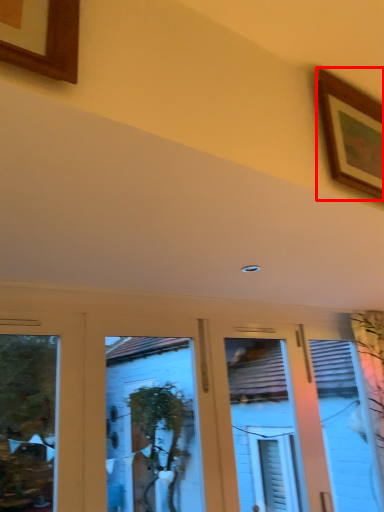
Question: In this image, where is picture frame (annotated by the red box) located relative to hotel lobby?

Choices:
 (A) right
 (B) left

Answer: (A)